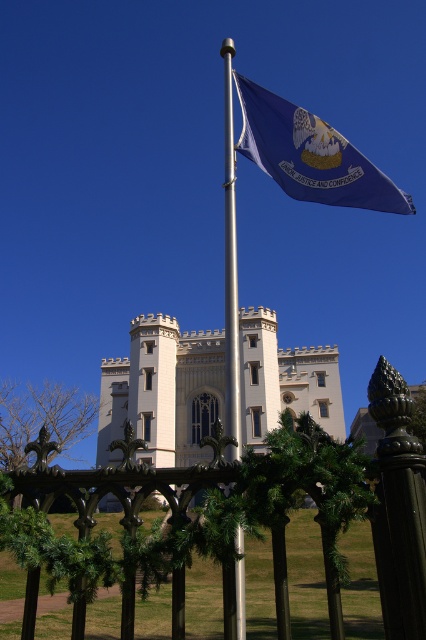
Between point (362, 177) and point (238, 563), which one is positioned in front?

Point (238, 563) is more forward.

Who is more forward, (x=337, y=150) or (x=233, y=387)?

Point (x=233, y=387)

Identify the location of blue fabric flag at upper center. (310, 154).

Is white stone palace at center smaller than silver metallic flag pole at center?

Incorrect, white stone palace at center is not smaller in size than silver metallic flag pole at center.

Between point (178, 419) and point (238, 422), which one is positioned in front?

Point (238, 422)

The height and width of the screenshot is (640, 426). What are the coordinates of `white stone palace at center` in the screenshot? It's located at (163, 392).

Does white stone palace at center appear on the left side of blue fabric flag at upper center?

A: Yes, white stone palace at center is to the left of blue fabric flag at upper center.

Between white stone palace at center and blue fabric flag at upper center, which one appears on the right side from the viewer's perspective?

blue fabric flag at upper center is more to the right.

At what (x,y) coordinates should I click in order to perform the action: click on white stone palace at center. Please return your answer as a coordinate pair (x, y). The width and height of the screenshot is (426, 640). Looking at the image, I should click on (163, 392).